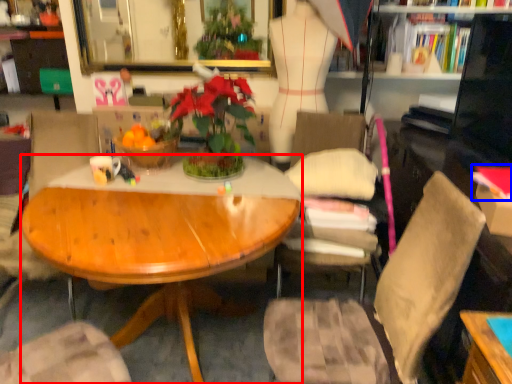
Question: Which object appears farthest to the camera in this image, desk (highlighted by a red box) or book (highlighted by a blue box)?

Choices:
 (A) desk
 (B) book

Answer: (B)